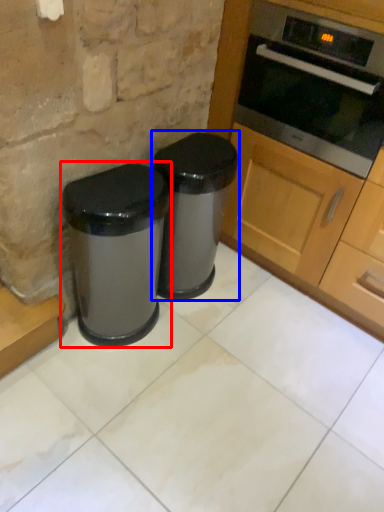
Question: Which object is closer to the camera taking this photo, waste container (highlighted by a red box) or waste container (highlighted by a blue box)?

Choices:
 (A) waste container
 (B) waste container

Answer: (A)